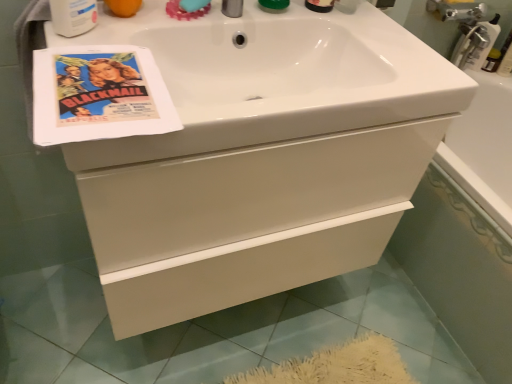
Question: Is white plastic mouthwash at upper left not near vintage paper flyer at upper left?

Choices:
 (A) no
 (B) yes

Answer: (A)

Question: Does white plastic mouthwash at upper left have a lesser width compared to vintage paper flyer at upper left?

Choices:
 (A) yes
 (B) no

Answer: (A)

Question: Does white plastic mouthwash at upper left appear on the right side of vintage paper flyer at upper left?

Choices:
 (A) yes
 (B) no

Answer: (B)

Question: From the image's perspective, is white plastic mouthwash at upper left under vintage paper flyer at upper left?

Choices:
 (A) yes
 (B) no

Answer: (B)

Question: Is vintage paper flyer at upper left surrounded by white plastic mouthwash at upper left?

Choices:
 (A) yes
 (B) no

Answer: (B)

Question: Is white plastic mouthwash at upper left positioned before vintage paper flyer at upper left?

Choices:
 (A) yes
 (B) no

Answer: (B)

Question: Is vintage paper flyer at upper left taller than white glossy cabinet at center?

Choices:
 (A) yes
 (B) no

Answer: (B)

Question: From a real-world perspective, does vintage paper flyer at upper left sit lower than white glossy cabinet at center?

Choices:
 (A) no
 (B) yes

Answer: (A)

Question: Is vintage paper flyer at upper left at the right side of white glossy cabinet at center?

Choices:
 (A) no
 (B) yes

Answer: (A)

Question: From the image's perspective, is vintage paper flyer at upper left above white glossy cabinet at center?

Choices:
 (A) yes
 (B) no

Answer: (A)

Question: Is vintage paper flyer at upper left closer to the viewer compared to white glossy cabinet at center?

Choices:
 (A) no
 (B) yes

Answer: (B)

Question: From a real-world perspective, is vintage paper flyer at upper left positioned over white glossy cabinet at center based on gravity?

Choices:
 (A) no
 (B) yes

Answer: (B)

Question: Is white glossy cabinet at center oriented away from white plastic mouthwash at upper left?

Choices:
 (A) yes
 (B) no

Answer: (B)